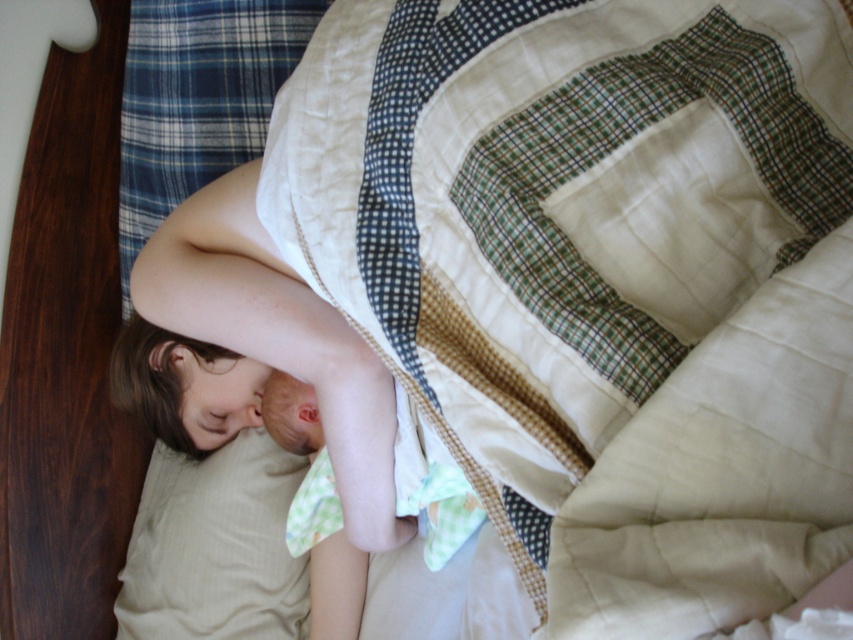
Question: Which object is the closest to the beige fabric pillow at lower left?

Choices:
 (A) smooth skin girl at center
 (B) quilted beige blanket at center

Answer: (A)

Question: Which point is closer to the camera?

Choices:
 (A) quilted beige blanket at center
 (B) beige fabric pillow at lower left
 (C) smooth skin girl at center

Answer: (A)

Question: Does quilted beige blanket at center appear on the right side of beige fabric pillow at lower left?

Choices:
 (A) no
 (B) yes

Answer: (B)

Question: Does smooth skin girl at center have a lesser width compared to beige fabric pillow at lower left?

Choices:
 (A) yes
 (B) no

Answer: (B)

Question: Which of the following is the closest to the observer?

Choices:
 (A) (135, 554)
 (B) (672, 552)
 (C) (117, 374)

Answer: (B)

Question: Observing the image, what is the correct spatial positioning of quilted beige blanket at center in reference to smooth skin girl at center?

Choices:
 (A) right
 (B) left

Answer: (A)